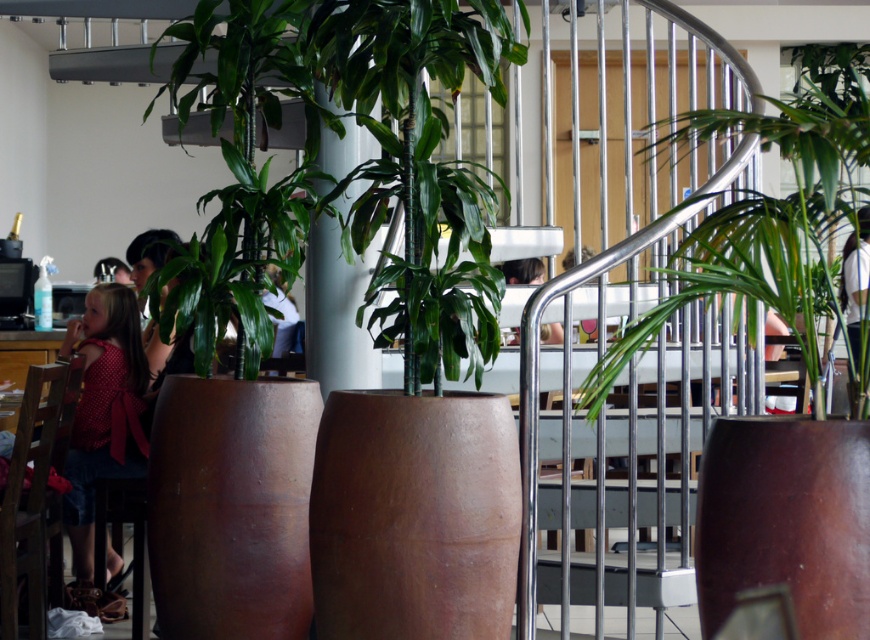
Consider the image. You are a photographer trying to capture a candid shot of the light brown hair at center and the matte pink shirt at center. Since you want to focus on the person, which object should you zoom in on to ensure the person is clearly visible?

The light brown hair at center has a larger size compared to matte pink shirt at center, so zooming in on the light brown hair at center would ensure the person is clearly visible.

You are standing in the modern cafe and notice a person with light brown hair at center. Where exactly is their hair positioned in the scene?

The light brown hair at center is located at point (844, 268).